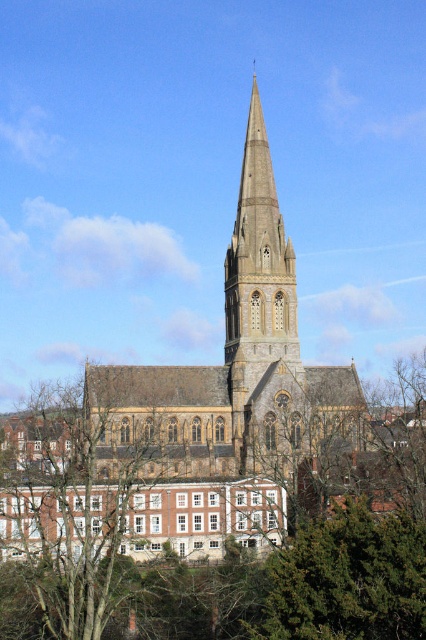
You are standing in front of the historic church and notice two points marked on the spire. The first point is at coordinates point (x=29, y=518) and the second is at point (x=140, y=429). Which point is closer to you?

Point (x=29, y=518) is closer to the viewer than point (x=140, y=429).

You are standing in front of the historic church and notice a green leafy tree at center. Based on its coordinates, is the tree positioned closer to the left or right side of the church?

The green leafy tree at center is located at point 0.773 on the x and y axis, so it is positioned closer to the right side of the church.

You are standing in front of the historic church and notice two trees in the scene. Which tree, the green leafy tree at center or the brown wood tree at lower left, is positioned closer to you?

The green leafy tree at center is closer to the viewer than the brown wood tree at lower left.